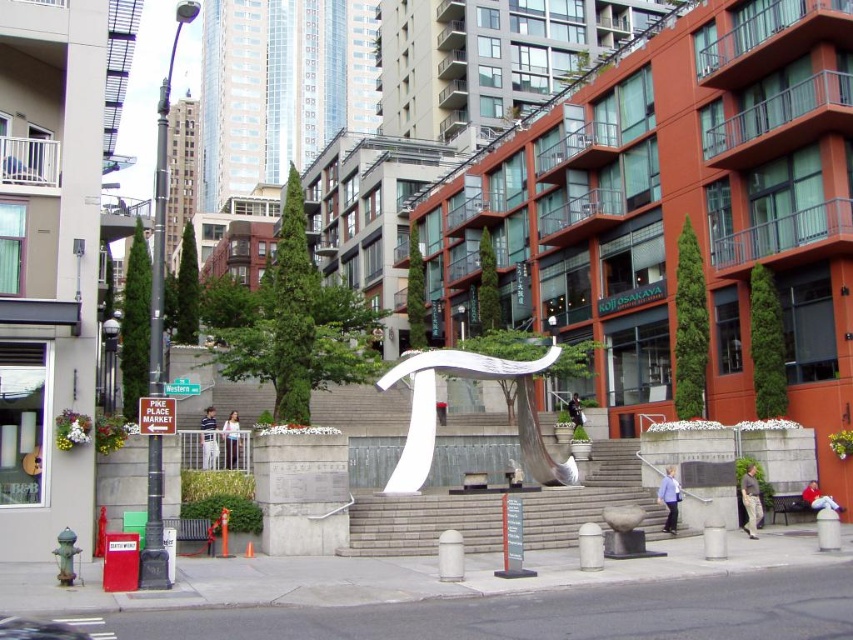
You are standing at the bottom of the gray concrete stairs at center and want to reach the white polished metal pi symbol at center. Which direction should you move to get closer to the symbol?

The gray concrete stairs at center are closer to the viewer than the white polished metal pi symbol at center. To reach the symbol, you should move forward up the stairs since the symbol is further away and located above the stairs.

You are an architect designing a new sculpture installation. You need to ensure that the gray concrete stairs at center will not block the view of the white polished metal pi symbol at center from the main entrance. Based on their heights, is this possible?

The gray concrete stairs at center is not as tall as white polished metal pi symbol at center, so it is possible to ensure that the stairs do not block the view of the pi symbol from the main entrance since the stairs are shorter in height.